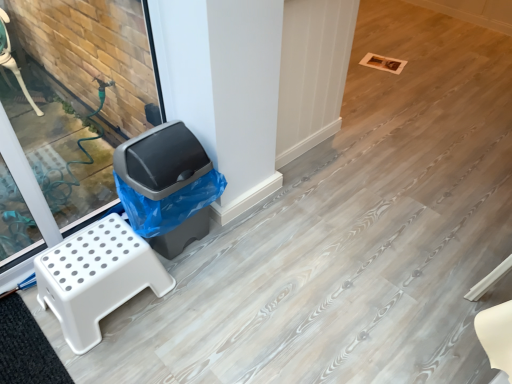
Question: Is white plastic step stool at left taller than black rubber mat at lower left?

Choices:
 (A) yes
 (B) no

Answer: (A)

Question: Considering the relative sizes of white plastic step stool at left and black rubber mat at lower left in the image provided, is white plastic step stool at left bigger than black rubber mat at lower left?

Choices:
 (A) no
 (B) yes

Answer: (B)

Question: Is white plastic step stool at left thinner than black rubber mat at lower left?

Choices:
 (A) yes
 (B) no

Answer: (B)

Question: Could you tell me if white plastic step stool at left is turned towards black rubber mat at lower left?

Choices:
 (A) no
 (B) yes

Answer: (A)

Question: Can you confirm if white plastic step stool at left is positioned to the left of black rubber mat at lower left?

Choices:
 (A) yes
 (B) no

Answer: (B)

Question: From a real-world perspective, is black rubber mat at lower left above or below white plastic step stool at left?

Choices:
 (A) above
 (B) below

Answer: (B)

Question: In the image, is black rubber mat at lower left positioned in front of or behind white plastic step stool at left?

Choices:
 (A) front
 (B) behind

Answer: (A)

Question: Considering the positions of black rubber mat at lower left and white plastic step stool at left in the image, is black rubber mat at lower left taller or shorter than white plastic step stool at left?

Choices:
 (A) short
 (B) tall

Answer: (A)

Question: Is point (15, 350) positioned closer to the camera than point (89, 344)?

Choices:
 (A) closer
 (B) farther

Answer: (A)

Question: Based on their positions, is black rubber mat at lower left located to the left or right of gray plastic trash can at left?

Choices:
 (A) right
 (B) left

Answer: (B)

Question: Based on their sizes in the image, would you say black rubber mat at lower left is bigger or smaller than gray plastic trash can at left?

Choices:
 (A) big
 (B) small

Answer: (B)

Question: Relative to gray plastic trash can at left, is black rubber mat at lower left in front or behind?

Choices:
 (A) behind
 (B) front

Answer: (B)

Question: From the image's perspective, is black rubber mat at lower left positioned above or below gray plastic trash can at left?

Choices:
 (A) above
 (B) below

Answer: (B)

Question: From a real-world perspective, relative to white plastic step stool at left, is gray plastic trash can at left vertically above or below?

Choices:
 (A) below
 (B) above

Answer: (B)

Question: Based on their sizes in the image, would you say gray plastic trash can at left is bigger or smaller than white plastic step stool at left?

Choices:
 (A) big
 (B) small

Answer: (A)